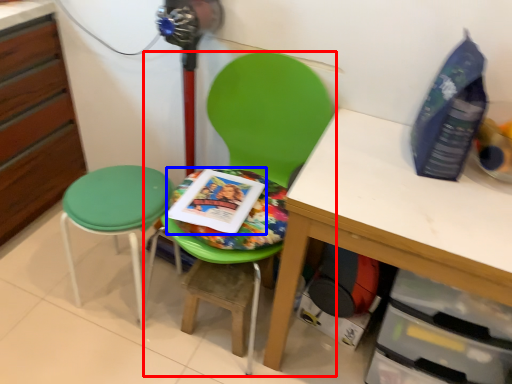
Question: Which object is further to the camera taking this photo, chair (highlighted by a red box) or paperback book (highlighted by a blue box)?

Choices:
 (A) chair
 (B) paperback book

Answer: (B)